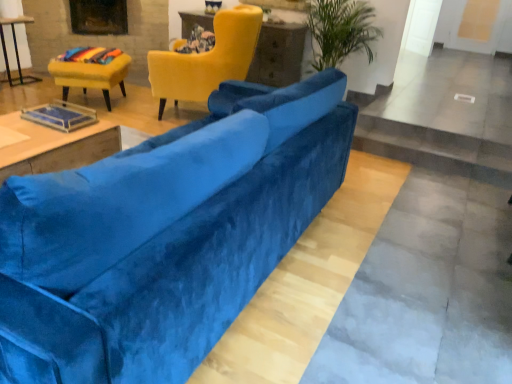
This screenshot has height=384, width=512. I want to click on velvet yellow armchair at upper center, arranged as the first chair when viewed from the right, so click(207, 59).

Identify the location of velvet yellow chair at upper left, which is the first chair in left-to-right order. (91, 75).

Locate an element on the screen. The height and width of the screenshot is (384, 512). rainbow fabric cushion at upper left is located at coordinates (90, 55).

What do you see at coordinates (55, 147) in the screenshot? I see `wooden table at center, which ranks as the 2th table in right-to-left order` at bounding box center [55, 147].

What are the coordinates of `matte yellow table at upper center, which ranks as the 1th table in back-to-front order` in the screenshot? It's located at (278, 54).

The image size is (512, 384). I want to click on dark brown wood fireplace at upper left, so click(99, 17).

Is point (19, 59) farther from camera compared to point (68, 52)?

Yes, it is behind point (68, 52).

In terms of height, does matte black table at left, positioned as the 2th table in bottom-to-top order, look taller or shorter compared to rainbow fabric cushion at upper left?

Clearly, matte black table at left, positioned as the 2th table in bottom-to-top order, is taller compared to rainbow fabric cushion at upper left.

The image size is (512, 384). What are the coordinates of `material located in front of the matte black table at left, positioned as the second table in front-to-back order` in the screenshot? It's located at (90, 55).

Which object is positioned more to the left, matte black table at left, positioned as the second table in front-to-back order, or rainbow fabric cushion at upper left?

matte black table at left, positioned as the second table in front-to-back order.

Where is `material above the wooden table at center, placed as the 1th table when sorted from front to back (from a real-world perspective)`? material above the wooden table at center, placed as the 1th table when sorted from front to back (from a real-world perspective) is located at coordinates (90, 55).

How distant is rainbow fabric cushion at upper left from wooden table at center, placed as the 1th table when sorted from front to back?

They are 6.83 feet apart.

Is wooden table at center, which ranks as the 2th table in right-to-left order, a part of rainbow fabric cushion at upper left?

Answer: Definitely not — wooden table at center, which ranks as the 2th table in right-to-left order, is not inside rainbow fabric cushion at upper left.

How different are the orientations of rainbow fabric cushion at upper left and wooden table at center, which ranks as the 2th table in right-to-left order, in degrees?

There is a 117-degree angle between the facing directions of rainbow fabric cushion at upper left and wooden table at center, which ranks as the 2th table in right-to-left order.

From the image's perspective, is rainbow fabric cushion at upper left positioned above or below matte black table at left, the 3th table from the right?

rainbow fabric cushion at upper left is below matte black table at left, the 3th table from the right.

Looking at this image, can you confirm if rainbow fabric cushion at upper left is thinner than matte black table at left, which ranks as the 1th table in left-to-right order?

In fact, rainbow fabric cushion at upper left might be wider than matte black table at left, which ranks as the 1th table in left-to-right order.

Consider the image. Is rainbow fabric cushion at upper left not within matte black table at left, positioned as the 2th table in bottom-to-top order?

Yes, rainbow fabric cushion at upper left is located beyond the bounds of matte black table at left, positioned as the 2th table in bottom-to-top order.

Who is smaller, rainbow fabric cushion at upper left or matte black table at left, the 2th table in the back-to-front sequence?

rainbow fabric cushion at upper left.

From a real-world perspective, which object stands above the other?

From a 3D spatial view, rainbow fabric cushion at upper left is above.

Are matte yellow table at upper center, the first table in the top-to-bottom sequence, and rainbow fabric cushion at upper left making contact?

No, matte yellow table at upper center, the first table in the top-to-bottom sequence, is not making contact with rainbow fabric cushion at upper left.

At what (x,y) coordinates should I click in order to perform the action: click on the 2nd table to the right of the rainbow fabric cushion at upper left, starting your count from the anchor. Please return your answer as a coordinate pair (x, y). Image resolution: width=512 pixels, height=384 pixels. Looking at the image, I should click on pyautogui.click(x=278, y=54).

Can you tell me how much dark brown wood fireplace at upper left and matte black table at left, positioned as the second table in front-to-back order, differ in facing direction?

They differ by 41.3 degrees in their facing directions.

From the image's perspective, does dark brown wood fireplace at upper left appear higher than matte black table at left, the second table from the top?

Yes, from the image's perspective, dark brown wood fireplace at upper left is over matte black table at left, the second table from the top.

Which of these two, dark brown wood fireplace at upper left or matte black table at left, the 2th table in the back-to-front sequence, stands shorter?

dark brown wood fireplace at upper left.

Does dark brown wood fireplace at upper left contain matte black table at left, the 3th table from the right?

No, matte black table at left, the 3th table from the right, is not inside dark brown wood fireplace at upper left.

Which object is wider, velvet yellow chair at upper left, which is counted as the 2th chair, starting from the right, or matte yellow table at upper center, which is counted as the third table, starting from the front?

velvet yellow chair at upper left, which is counted as the 2th chair, starting from the right, is wider.

From a real-world perspective, is velvet yellow chair at upper left, which is counted as the 2th chair, starting from the right, above or below matte yellow table at upper center, which is the first table in right-to-left order?

velvet yellow chair at upper left, which is counted as the 2th chair, starting from the right, is situated lower than matte yellow table at upper center, which is the first table in right-to-left order, in the real world.

Is matte yellow table at upper center, which is counted as the third table, starting from the front, surrounded by velvet yellow chair at upper left, which is the first chair in left-to-right order?

No, matte yellow table at upper center, which is counted as the third table, starting from the front, is located outside of velvet yellow chair at upper left, which is the first chair in left-to-right order.

Is wooden table at center, the 2th table when ordered from left to right, outside of velvet blue couch at center?

Yes, wooden table at center, the 2th table when ordered from left to right, is located beyond the bounds of velvet blue couch at center.

Considering the sizes of wooden table at center, which is counted as the 3th table, starting from the back, and velvet blue couch at center in the image, is wooden table at center, which is counted as the 3th table, starting from the back, wider or thinner than velvet blue couch at center?

In the image, wooden table at center, which is counted as the 3th table, starting from the back, appears to be more narrow than velvet blue couch at center.

From a real-world perspective, which object rests below the other?

wooden table at center, the 3th table in the top-to-bottom sequence, is physically lower.

Who is shorter, wooden table at center, which ranks as the first table in bottom-to-top order, or velvet blue couch at center?

Standing shorter between the two is wooden table at center, which ranks as the first table in bottom-to-top order.

This screenshot has width=512, height=384. I want to click on the 2nd table located beneath the rainbow fabric cushion at upper left (from a real-world perspective), so click(15, 51).

Identify the location of table in front of the rainbow fabric cushion at upper left. The width and height of the screenshot is (512, 384). (55, 147).

When comparing their distances from matte black table at left, positioned as the second table in front-to-back order, does wooden table at center, placed as the 1th table when sorted from front to back, or velvet blue couch at center seem further?

The object further to matte black table at left, positioned as the second table in front-to-back order, is velvet blue couch at center.

When comparing their distances from wooden table at center, placed as the 1th table when sorted from front to back, does dark brown wood fireplace at upper left or matte yellow table at upper center, the 3th table when ordered from bottom to top, seem closer?

matte yellow table at upper center, the 3th table when ordered from bottom to top, is closer to wooden table at center, placed as the 1th table when sorted from front to back.

Considering their positions, is velvet yellow armchair at upper center, the 2th chair when ordered from left to right, positioned further to wooden table at center, the 3th table in the top-to-bottom sequence, than rainbow fabric cushion at upper left?

Based on the image, rainbow fabric cushion at upper left appears to be further to wooden table at center, the 3th table in the top-to-bottom sequence.

From the image, which object appears to be farther from rainbow fabric cushion at upper left, velvet yellow armchair at upper center, arranged as the first chair when viewed from the right, or matte yellow table at upper center, the first table in the top-to-bottom sequence?

matte yellow table at upper center, the first table in the top-to-bottom sequence, lies further to rainbow fabric cushion at upper left than the other object.

Estimate the real-world distances between objects in this image. Which object is further from velvet yellow armchair at upper center, the 2th chair when ordered from left to right, rainbow fabric cushion at upper left or matte black table at left, positioned as the 2th table in bottom-to-top order?

The object further to velvet yellow armchair at upper center, the 2th chair when ordered from left to right, is matte black table at left, positioned as the 2th table in bottom-to-top order.

Which object lies nearer to the anchor point wooden table at center, the 3th table in the top-to-bottom sequence, velvet yellow chair at upper left, which is the first chair in left-to-right order, or dark brown wood fireplace at upper left?

Based on the image, velvet yellow chair at upper left, which is the first chair in left-to-right order, appears to be nearer to wooden table at center, the 3th table in the top-to-bottom sequence.

When comparing their distances from velvet yellow armchair at upper center, arranged as the first chair when viewed from the right, does matte black table at left, which ranks as the 1th table in left-to-right order, or wooden table at center, which ranks as the 2th table in right-to-left order, seem closer?

wooden table at center, which ranks as the 2th table in right-to-left order.

When comparing their distances from dark brown wood fireplace at upper left, does velvet yellow chair at upper left, which is the first chair in left-to-right order, or rainbow fabric cushion at upper left seem closer?

rainbow fabric cushion at upper left is closer to dark brown wood fireplace at upper left.

Identify the location of material between velvet yellow chair at upper left, which is the first chair in left-to-right order, and velvet yellow armchair at upper center, the 2th chair when ordered from left to right. (90, 55).

Locate an element on the screen. The height and width of the screenshot is (384, 512). chair between velvet yellow chair at upper left, which is counted as the 2th chair, starting from the right, and matte yellow table at upper center, the 3th table when ordered from bottom to top, from left to right is located at coordinates (207, 59).

Where is `fireplace situated between matte black table at left, the 2th table in the back-to-front sequence, and matte yellow table at upper center, placed as the third table when sorted from left to right, from left to right`? fireplace situated between matte black table at left, the 2th table in the back-to-front sequence, and matte yellow table at upper center, placed as the third table when sorted from left to right, from left to right is located at coordinates (99, 17).

You are a GUI agent. You are given a task and a screenshot of the screen. Output one action in this format:
    pyautogui.click(x=<x>, y=<y>)
    Task: Click on the fireplace situated between matte black table at left, positioned as the 2th table in bottom-to-top order, and velvet yellow armchair at upper center, arranged as the first chair when viewed from the right, from left to right
    This screenshot has height=384, width=512.
    Given the screenshot: What is the action you would take?
    pyautogui.click(x=99, y=17)